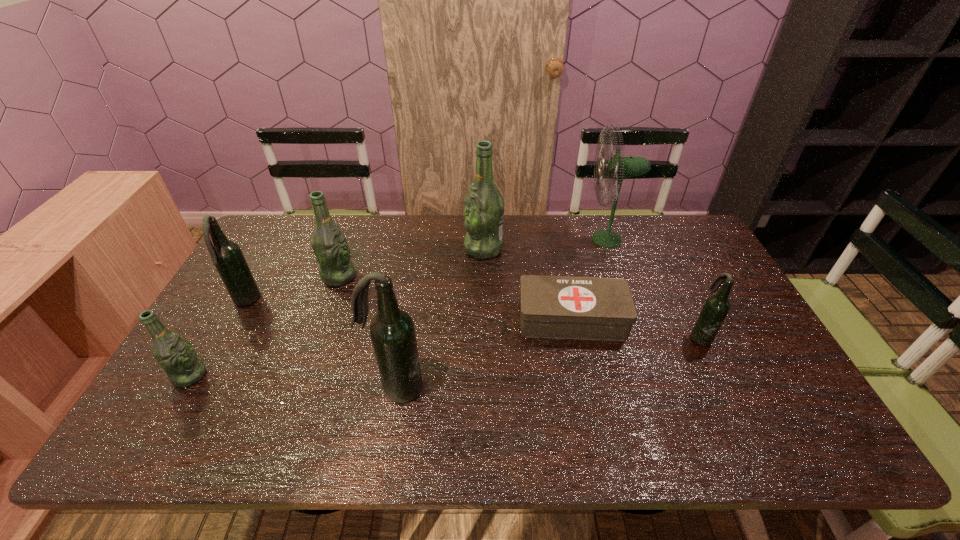
What are the coordinates of `free spot located on the back of the biggest dark beer bottle` in the screenshot? It's located at (412, 292).

Where is `free space located on the surface of the fifth nearest beer bottle`? This screenshot has height=540, width=960. free space located on the surface of the fifth nearest beer bottle is located at coordinates (436, 276).

You are a GUI agent. You are given a task and a screenshot of the screen. Output one action in this format:
    pyautogui.click(x=<x>, y=<y>)
    Task: Click on the free point located 0.060m on the right of the third farthest beer bottle
    Image resolution: width=960 pixels, height=540 pixels.
    Given the screenshot: What is the action you would take?
    pyautogui.click(x=278, y=302)

Locate an element on the screen. This screenshot has width=960, height=540. vacant space situated 0.070m on the back of the rightmost dark beer bottle is located at coordinates (685, 307).

In order to click on free space located 0.070m on the surface of the nearest green beer bottle in this screenshot , I will do `click(233, 375)`.

Where is `free location located on the front of the shortest object`? The image size is (960, 540). free location located on the front of the shortest object is located at coordinates (586, 387).

The height and width of the screenshot is (540, 960). I want to click on fan at the far edge, so click(x=618, y=167).

Identify the location of beer bottle present at the far edge. (484, 206).

Find the location of a particular element. The width and height of the screenshot is (960, 540). object that is positioned at the right edge is located at coordinates pos(716,307).

This screenshot has width=960, height=540. In the image, there is a desktop. Find the location of `vacant space at the far edge`. vacant space at the far edge is located at coordinates (430, 220).